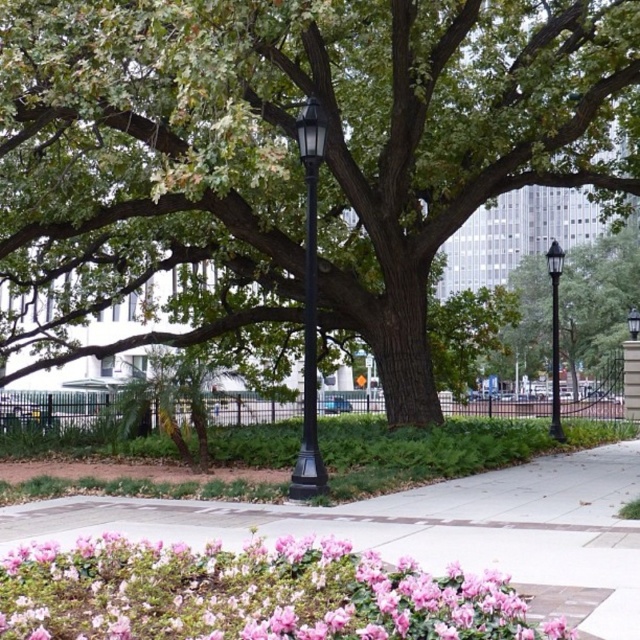
You are a gardener planning to water the green leafy tree at center and the pink matte flowers at lower left. Based on their positions, which one would you reach first if you start from the walkway near the flowers?

The pink matte flowers at lower left are on the left side of the green leafy tree at center, so you would reach them first since you start from the walkway near the flowers.

You are a pedestrian standing on the walkway and want to reach the black glass lamp post at center. Which object is closer to you as you face the green leafy tree at center?

The green leafy tree at center is closer to you than the black glass lamp post at center because the tree is positioned in front of the lamp post.